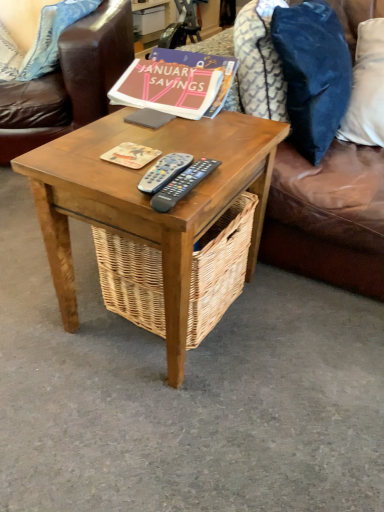
I want to click on free region on the left part of wooden side table at center, so click(40, 295).